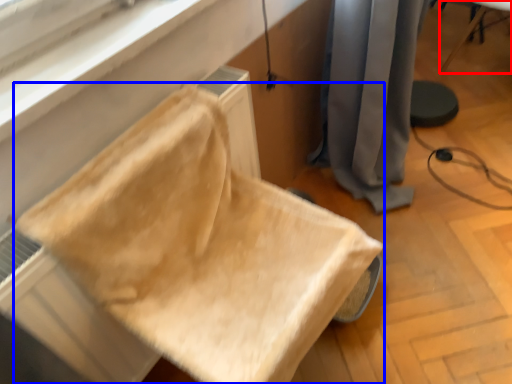
Question: Which of the following is the closest to the observer, furniture (highlighted by a red box) or furniture (highlighted by a blue box)?

Choices:
 (A) furniture
 (B) furniture

Answer: (B)